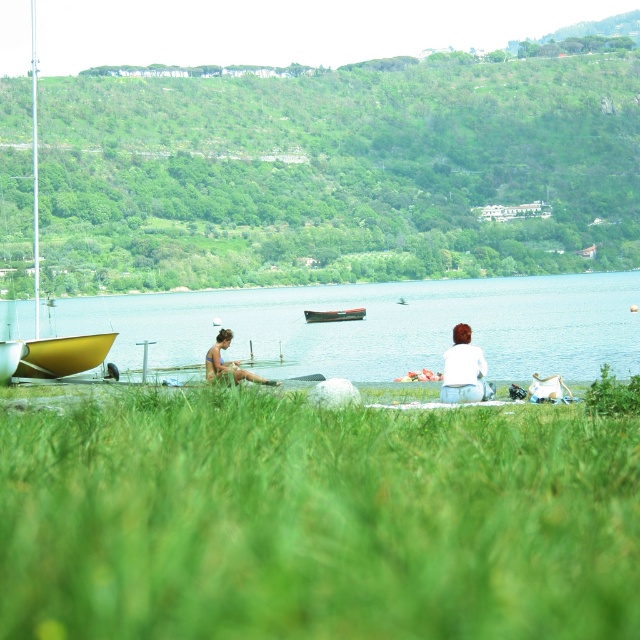
Question: Does matte blue swimsuit at center appear on the right side of metallic gray boat at center?

Choices:
 (A) no
 (B) yes

Answer: (A)

Question: Which point is closer to the camera?

Choices:
 (A) (458, 420)
 (B) (308, 310)

Answer: (A)

Question: Is yellow matte sailboat at left further to camera compared to matte blue swimsuit at center?

Choices:
 (A) yes
 (B) no

Answer: (A)

Question: Does green grassy field at lower center have a greater width compared to matte blue swimsuit at center?

Choices:
 (A) no
 (B) yes

Answer: (B)

Question: Which of the following is the closest to the observer?

Choices:
 (A) (307, 308)
 (B) (579, 339)
 (C) (330, 566)
 (D) (35, 340)

Answer: (C)

Question: Which object is farther from the camera taking this photo?

Choices:
 (A) white cotton shirt at center
 (B) blue water at center

Answer: (A)